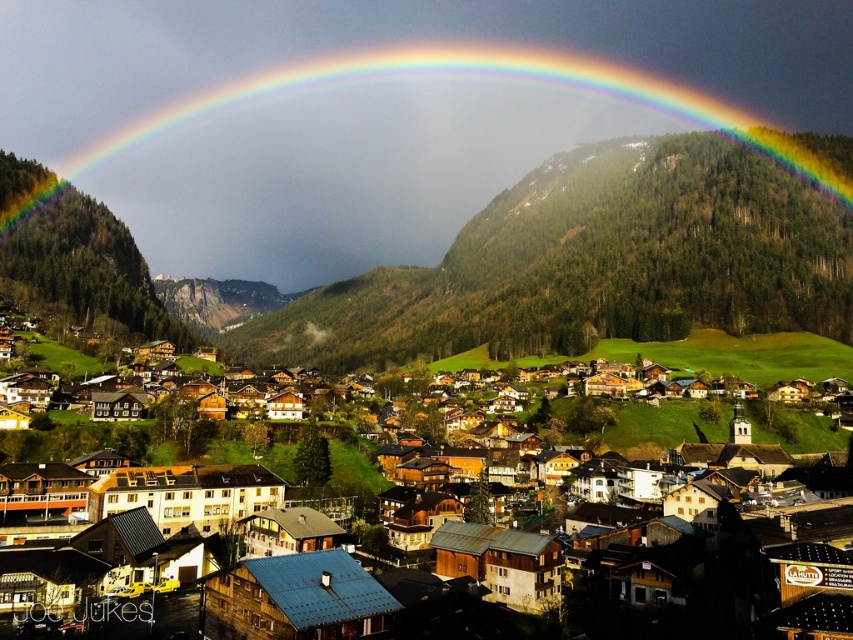
You are standing in the village and want to take a photo of the rainbow at upper center and the wooden houses at center together in the same frame. Based on their distance, will you need to zoom in or zoom out to include both in the shot?

The rainbow at upper center is 386.75 meters away from the wooden houses at center. To include both in the same frame, you would need to zoom out to capture the wider view required to encompass both the distant rainbow and the closer wooden houses.

You are an architect designing a new observation deck in the village. The deck will have a large window facing the mountains. To ensure the rainbow at upper center is always visible through the window, where should you place the window relative to the center of the deck?

The rainbow at upper center is located at coordinates point (378, 113), so the window should be placed slightly to the left and lower than the center of the deck to align with its position.

You are a photographer planning to capture the village from a viewpoint that allows you to see both the rainbow at upper center and the wooden houses at center. Based on their positions, which object should appear higher in your photo?

The rainbow at upper center appears higher in the photo because it is positioned above the wooden houses at center.